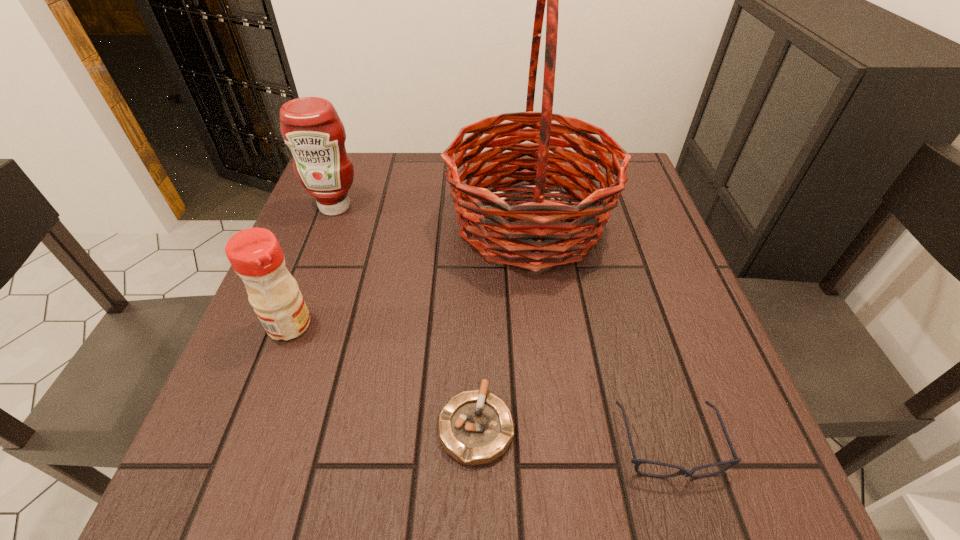
Locate an element on the screen. Image resolution: width=960 pixels, height=540 pixels. object that is at the far right corner is located at coordinates (518, 235).

Image resolution: width=960 pixels, height=540 pixels. In order to click on object at the near right corner in this screenshot , I will do `click(682, 471)`.

In the image, there is a desktop. Where is `vacant space at the far edge`? Image resolution: width=960 pixels, height=540 pixels. vacant space at the far edge is located at coordinates (396, 185).

Where is `free spot at the near edge of the desktop`? This screenshot has height=540, width=960. free spot at the near edge of the desktop is located at coordinates (469, 494).

This screenshot has width=960, height=540. Identify the location of vacant space at the left edge of the desktop. (285, 370).

In the image, there is a desktop. Where is `vacant area at the right edge`? This screenshot has height=540, width=960. vacant area at the right edge is located at coordinates (631, 239).

I want to click on blank space at the far left corner, so click(364, 161).

Where is `vacant space at the far right corner of the desktop`? The image size is (960, 540). vacant space at the far right corner of the desktop is located at coordinates (642, 188).

At what (x,y) coordinates should I click in order to perform the action: click on free space between the tallest object and the nearer condiment. Please return your answer as a coordinate pair (x, y). Image resolution: width=960 pixels, height=540 pixels. Looking at the image, I should click on (409, 274).

Find the location of `free space between the tallest object and the ashtray`. free space between the tallest object and the ashtray is located at coordinates (502, 325).